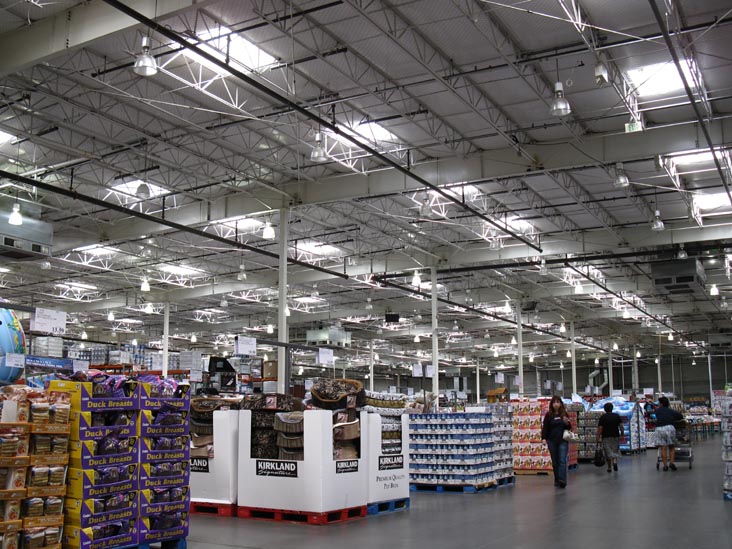
The height and width of the screenshot is (549, 732). In order to click on boxes of dog beds in this screenshot , I will do `click(291, 486)`, `click(205, 484)`.